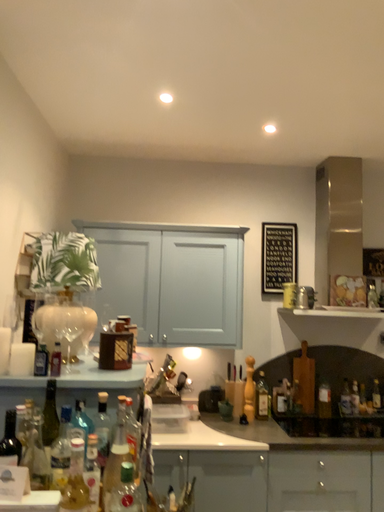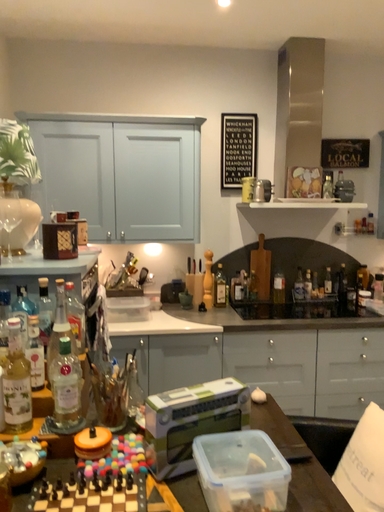
Question: How did the camera likely rotate when shooting the video?

Choices:
 (A) rotated upward
 (B) rotated downward

Answer: (B)